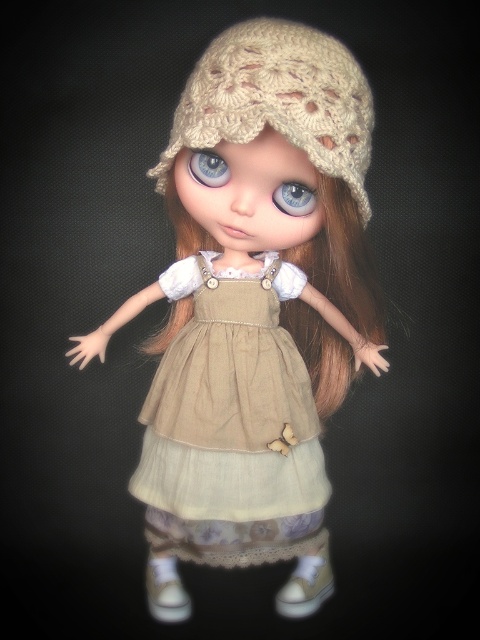
You are a toy designer examining the doll and need to ensure that the beige knitted hat at upper center and the blue glass eye at center are correctly sized for production. Based on the image, which object has a larger size?

The beige knitted hat at upper center has a larger size compared to the blue glass eye at center.

You are a fashion designer looking at the doll. You need to determine the order of the items from front to back. Which item is closer to you between the beige knitted hat at upper center and the beige cotton dress at center?

The beige knitted hat at upper center is in front of the beige cotton dress at center, so the beige knitted hat at upper center is closer to you.

You are positioning a camera to take a closeup shot of the doll. The camera is currently focused on the beige knitted hat at upper center. To ensure the entire hat is in frame, should you adjust the camera to zoom in or out?

The beige knitted hat at upper center is located at point (x=253, y=312), which means it is already centered in the frame. Therefore, no adjustment is needed. Keep the current zoom level to capture the hat fully in the frame.